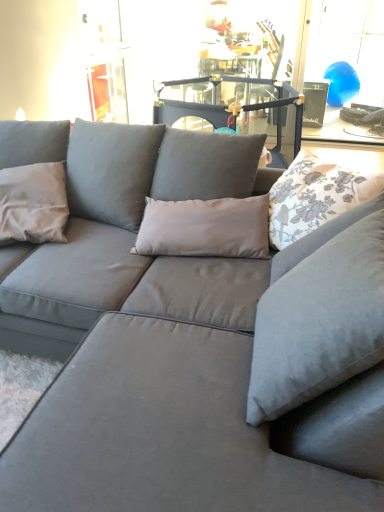
Question: From the image's perspective, is matte gray pillow at left, the first pillow from the left, located above or below white floral fabric pillow at upper right, arranged as the second pillow when viewed from the left?

Choices:
 (A) below
 (B) above

Answer: (A)

Question: Considering the positions of matte gray pillow at left, the 2th pillow positioned from the right, and white floral fabric pillow at upper right, acting as the 1th pillow starting from the right, in the image, is matte gray pillow at left, the 2th pillow positioned from the right, wider or thinner than white floral fabric pillow at upper right, acting as the 1th pillow starting from the right,?

Choices:
 (A) wide
 (B) thin

Answer: (B)

Question: Estimate the real-world distances between objects in this image. Which object is closer to the blue glossy balloon at upper right?

Choices:
 (A) matte gray pillow at left, the first pillow from the left
 (B) white floral fabric pillow at upper right, acting as the 1th pillow starting from the right

Answer: (B)

Question: Which of these objects is positioned closest to the blue glossy balloon at upper right?

Choices:
 (A) white floral fabric pillow at upper right, arranged as the second pillow when viewed from the left
 (B) matte gray pillow at left, the 2th pillow positioned from the right

Answer: (A)